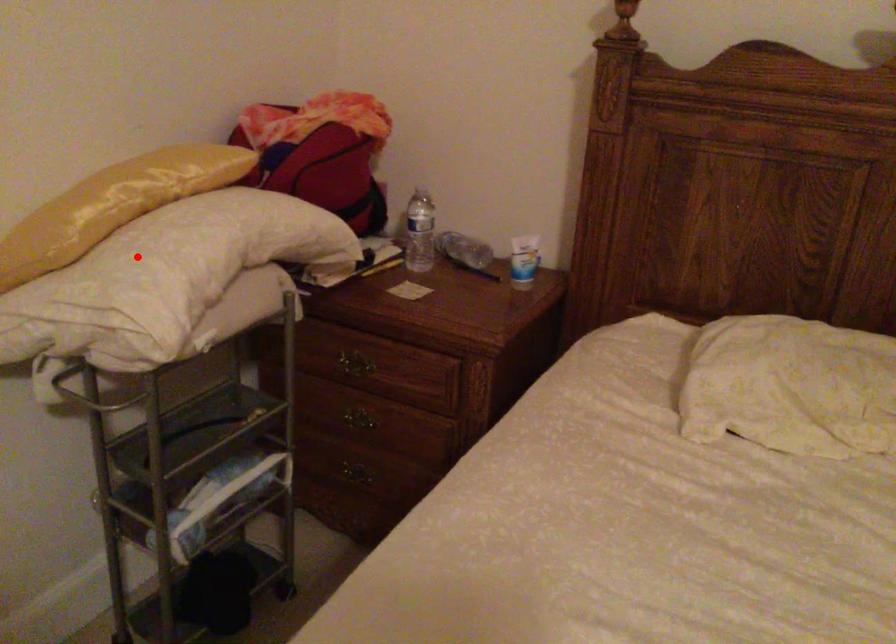
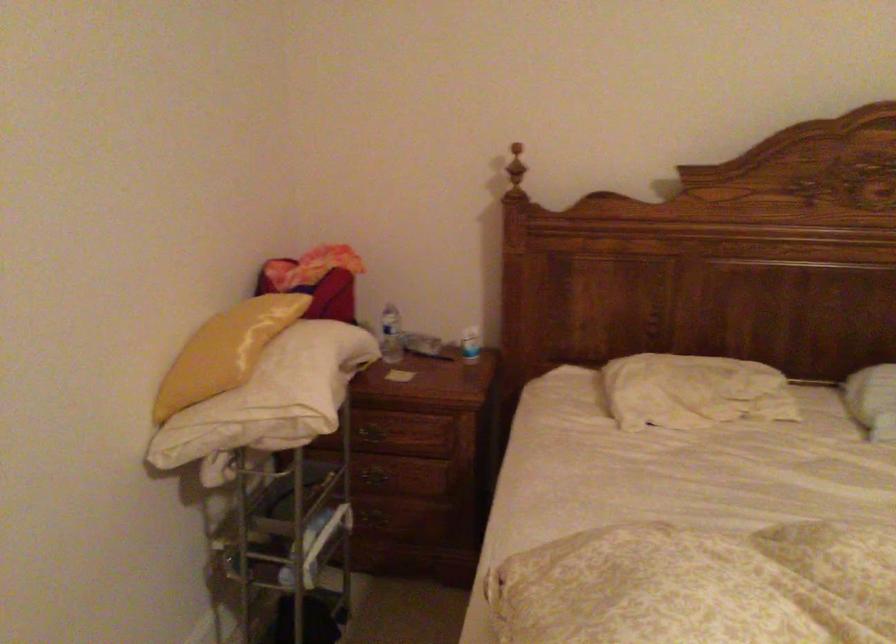
Question: I am providing you with two images of the same scene from different viewpoints. Given a red point in image1, look at the same physical point in image2. Is it:

Choices:
 (A) Closer to the viewpoint
 (B) Farther from the viewpoint

Answer: (B)